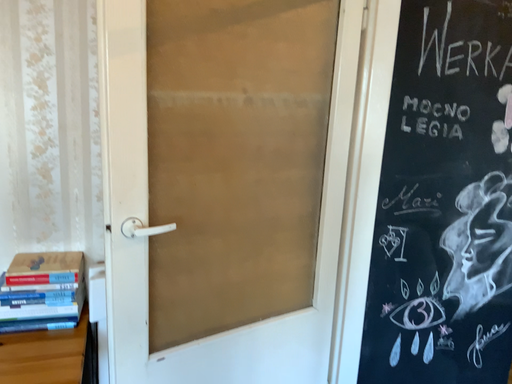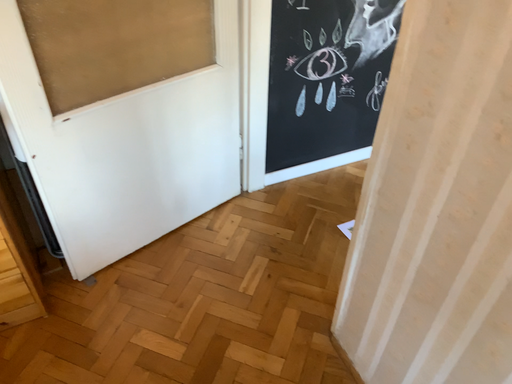
Question: Which way did the camera rotate in the video?

Choices:
 (A) rotated upward
 (B) rotated downward

Answer: (B)